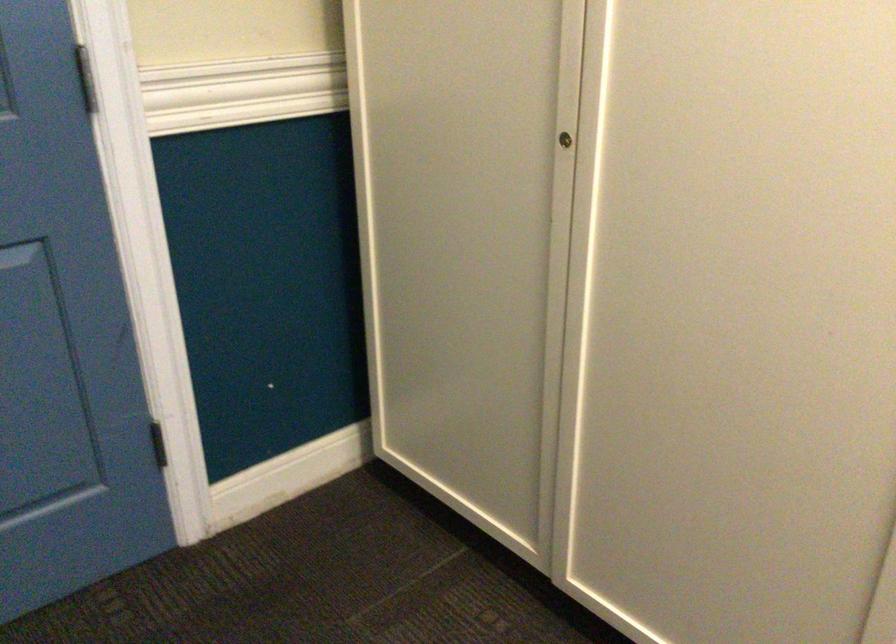
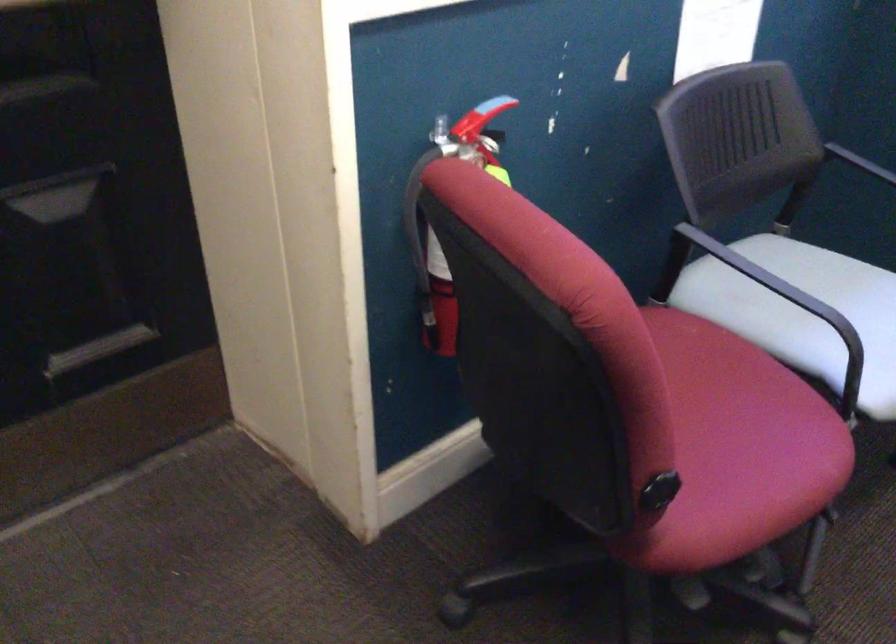
First-person continuous shooting, in which direction is the camera rotating?

The rotation direction of the camera is right-down.